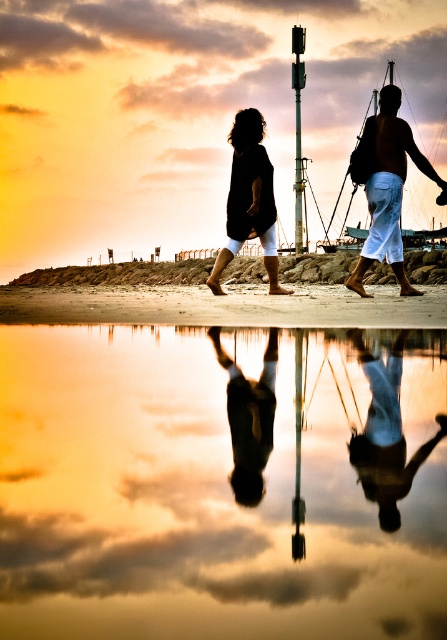
In the scene shown: Which is more to the right, reflective smooth water at center or smooth skin figure at center?

smooth skin figure at center is more to the right.

Does reflective smooth water at center have a smaller size compared to smooth skin figure at center?

Actually, reflective smooth water at center might be larger than smooth skin figure at center.

At what (x,y) coordinates should I click in order to perform the action: click on reflective smooth water at center. Please return your answer as a coordinate pair (x, y). The height and width of the screenshot is (640, 447). Looking at the image, I should click on (218, 486).

The image size is (447, 640). In order to click on reflective smooth water at center in this screenshot , I will do `click(218, 486)`.

Is point (361, 592) farther from viewer compared to point (378, 202)?

No, it is in front of (378, 202).

Looking at this image, measure the distance between reflective smooth water at center and black matte clothing at center.

The distance of reflective smooth water at center from black matte clothing at center is 8.00 meters.

Between point (248, 545) and point (392, 154), which one is positioned in front?

Point (248, 545) is in front.

I want to click on reflective smooth water at center, so click(218, 486).

Which is more to the left, reflective smooth water at center or black matte dress at center?

From the viewer's perspective, black matte dress at center appears more on the left side.

Can you confirm if reflective smooth water at center is thinner than black matte dress at center?

In fact, reflective smooth water at center might be wider than black matte dress at center.

Which is behind, point (142, 342) or point (261, 227)?

The point (261, 227) is more distant.

Image resolution: width=447 pixels, height=640 pixels. Identify the location of reflective smooth water at center. (218, 486).